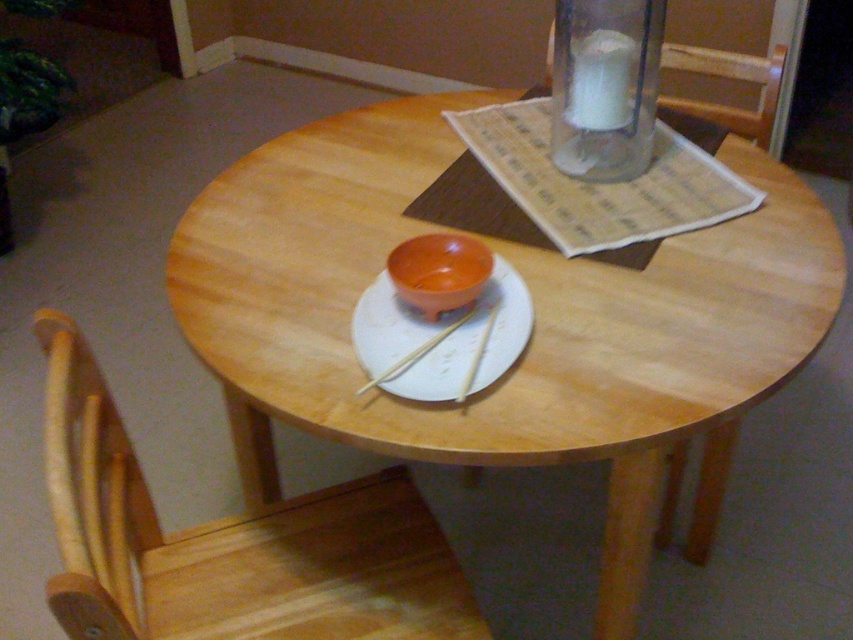
Question: Is white matte plate at center below transparent glass candle at upper center?

Choices:
 (A) no
 (B) yes

Answer: (B)

Question: Can you confirm if wooden chair at lower left is wider than matte orange bowl at center?

Choices:
 (A) yes
 (B) no

Answer: (A)

Question: Estimate the real-world distances between objects in this image. Which object is closer to the wooden chair at lower left?

Choices:
 (A) transparent glass candle at upper center
 (B) white matte plate at center
 (C) matte orange bowl at center
 (D) wooden round table at center

Answer: (D)

Question: Among these points, which one is nearest to the camera?

Choices:
 (A) (737, 61)
 (B) (616, 621)

Answer: (B)

Question: Is wooden chair at lower left positioned at the back of white matte plate at center?

Choices:
 (A) no
 (B) yes

Answer: (A)

Question: Which point appears closest to the camera in this image?

Choices:
 (A) (434, 285)
 (B) (567, 336)

Answer: (B)